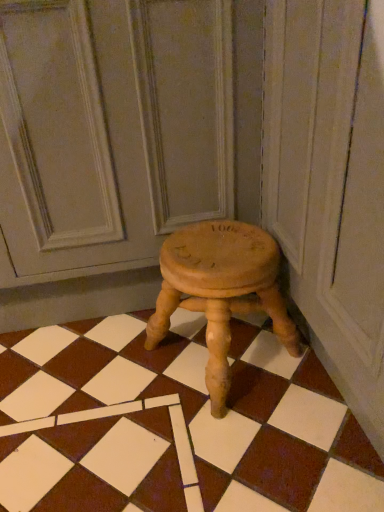
Where is `free location in front of wooden stool at center`? free location in front of wooden stool at center is located at coordinates (230, 452).